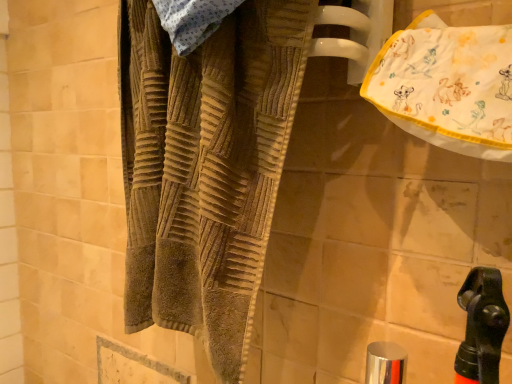
Where is `white cotton towel at upper right`? The image size is (512, 384). white cotton towel at upper right is located at coordinates (447, 85).

Is point (195, 234) positioned in front of point (403, 358)?

Yes, point (195, 234) is closer to viewer.

From the image's perspective, is brown textured towel at center over silver metallic faucet at lower center?

Correct, brown textured towel at center appears higher than silver metallic faucet at lower center in the image.

Between brown textured towel at center and silver metallic faucet at lower center, which one has more height?

Standing taller between the two is brown textured towel at center.

Is brown textured towel at center in front of silver metallic faucet at lower center?

Yes, it is.

Which is behind, point (390, 347) or point (414, 120)?

The point (390, 347) is farther.

From the image's perspective, between silver metallic faucet at lower center and white cotton towel at upper right, who is located below?

silver metallic faucet at lower center is shown below in the image.

Is silver metallic faucet at lower center bigger than white cotton towel at upper right?

No, silver metallic faucet at lower center is not bigger than white cotton towel at upper right.

Is silver metallic faucet at lower center positioned behind white cotton towel at upper right?

Yes.

Is white cotton towel at upper right positioned with its back to silver metallic faucet at lower center?

white cotton towel at upper right is not turned away from silver metallic faucet at lower center.

Which is in front, white cotton towel at upper right or silver metallic faucet at lower center?

white cotton towel at upper right is more forward.

Image resolution: width=512 pixels, height=384 pixels. I want to click on faucet directly beneath the brown textured towel at center (from a real-world perspective), so click(385, 363).

Are silver metallic faucet at lower center and brown textured towel at center making contact?

silver metallic faucet at lower center and brown textured towel at center are clearly separated.

Does silver metallic faucet at lower center have a lesser width compared to brown textured towel at center?

Yes, silver metallic faucet at lower center is thinner than brown textured towel at center.

Considering the sizes of objects white cotton towel at upper right and brown textured towel at center in the image provided, who is wider, white cotton towel at upper right or brown textured towel at center?

With larger width is brown textured towel at center.

Based on the photo, is white cotton towel at upper right positioned before brown textured towel at center?

Yes, it is.

How many degrees apart are the facing directions of white cotton towel at upper right and brown textured towel at center?

There is a 0.000558-degree angle between the facing directions of white cotton towel at upper right and brown textured towel at center.

From the image's perspective, is white cotton towel at upper right located above or below brown textured towel at center?

From the image's perspective, white cotton towel at upper right appears above brown textured towel at center.

Is white cotton towel at upper right at the back of brown textured towel at center?

No, white cotton towel at upper right is not at the back of brown textured towel at center.

Considering the relative positions of brown textured towel at center and white cotton towel at upper right in the image provided, is brown textured towel at center to the left of white cotton towel at upper right from the viewer's perspective?

Correct, you'll find brown textured towel at center to the left of white cotton towel at upper right.

Which is behind, point (163, 86) or point (501, 40)?

The point (163, 86) is farther.

Is brown textured towel at center positioned behind white cotton towel at upper right?

Yes, brown textured towel at center is further from the camera.

You are a GUI agent. You are given a task and a screenshot of the screen. Output one action in this format:
    pyautogui.click(x=<x>, y=<y>)
    Task: Click on the towel in front of the silver metallic faucet at lower center
    The width and height of the screenshot is (512, 384).
    Given the screenshot: What is the action you would take?
    pyautogui.click(x=206, y=167)

Find the location of a particular element. The width and height of the screenshot is (512, 384). beach towel lying above the silver metallic faucet at lower center (from the image's perspective) is located at coordinates (447, 85).

From the image, which object appears to be nearer to brown textured towel at center, white cotton towel at upper right or silver metallic faucet at lower center?

white cotton towel at upper right lies closer to brown textured towel at center than the other object.

Which object lies further to the anchor point brown textured towel at center, silver metallic faucet at lower center or white cotton towel at upper right?

Among the two, silver metallic faucet at lower center is located further to brown textured towel at center.

Looking at the image, which one is located closer to white cotton towel at upper right, silver metallic faucet at lower center or brown textured towel at center?

Among the two, brown textured towel at center is located nearer to white cotton towel at upper right.

Looking at this image, when comparing their distances from silver metallic faucet at lower center, does brown textured towel at center or white cotton towel at upper right seem further?

brown textured towel at center.

Considering their positions, is brown textured towel at center positioned further to white cotton towel at upper right than silver metallic faucet at lower center?

silver metallic faucet at lower center is positioned further to the anchor white cotton towel at upper right.

Estimate the real-world distances between objects in this image. Which object is closer to silver metallic faucet at lower center, white cotton towel at upper right or brown textured towel at center?

white cotton towel at upper right lies closer to silver metallic faucet at lower center than the other object.

Identify the location of towel between white cotton towel at upper right and silver metallic faucet at lower center vertically. This screenshot has height=384, width=512. (206, 167).